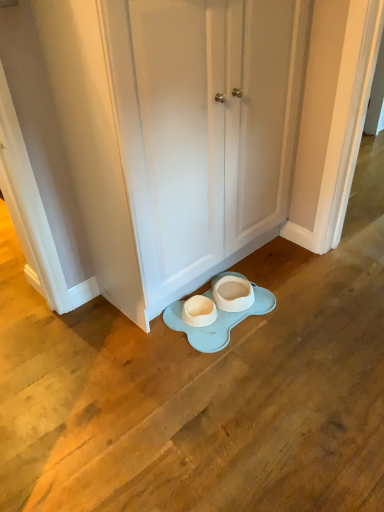
The image size is (384, 512). What do you see at coordinates (217, 322) in the screenshot?
I see `white matte porcelain at center` at bounding box center [217, 322].

Identify the location of white matte porcelain at center. The height and width of the screenshot is (512, 384). (217, 322).

What do you see at coordinates (203, 129) in the screenshot? The image size is (384, 512). I see `white matte door at center` at bounding box center [203, 129].

Locate an element on the screen. This screenshot has height=512, width=384. white matte door at center is located at coordinates (203, 129).

This screenshot has height=512, width=384. I want to click on white matte porcelain at center, so (217, 322).

Between white matte porcelain at center and white matte door at center, which one appears on the right side from the viewer's perspective?

white matte door at center.

Between white matte porcelain at center and white matte door at center, which one is positioned in front?

Positioned in front is white matte door at center.

Between point (211, 330) and point (250, 176), which one is positioned in front?

The point (211, 330) is closer to the camera.

From the image's perspective, which object appears higher, white matte porcelain at center or white matte door at center?

white matte door at center appears higher in the image.

From a real-world perspective, is white matte porcelain at center located beneath white matte door at center?

Yes, from a real-world perspective, white matte porcelain at center is beneath white matte door at center.

From the picture: Does white matte porcelain at center have a greater width compared to white matte door at center?

Yes, white matte porcelain at center is wider than white matte door at center.

Who is shorter, white matte porcelain at center or white matte door at center?

white matte porcelain at center is shorter.

Considering the relative sizes of white matte porcelain at center and white matte door at center in the image provided, is white matte porcelain at center smaller than white matte door at center?

Yes.

Is white matte porcelain at center inside the boundaries of white matte door at center, or outside?

white matte porcelain at center is located beyond the bounds of white matte door at center.

From the picture: Are white matte porcelain at center and white matte door at center located far from each other?

No, white matte porcelain at center is in close proximity to white matte door at center.

Is white matte porcelain at center positioned with its back to white matte door at center?

No, white matte porcelain at center's orientation is not away from white matte door at center.

Identify the location of door lying in front of the white matte porcelain at center. (203, 129).

Does white matte door at center appear on the right side of white matte porcelain at center?

Yes, white matte door at center is to the right of white matte porcelain at center.

Does white matte door at center come behind white matte porcelain at center?

No, the depth of white matte door at center is less than that of white matte porcelain at center.

Does point (170, 31) lie behind point (211, 326)?

That is False.

From the image's perspective, which one is positioned lower, white matte door at center or white matte porcelain at center?

white matte porcelain at center, from the image's perspective.

From a real-world perspective, who is located higher, white matte door at center or white matte porcelain at center?

white matte door at center.

Between white matte door at center and white matte porcelain at center, which one has larger width?

Wider between the two is white matte porcelain at center.

Is white matte door at center taller or shorter than white matte porcelain at center?

In the image, white matte door at center appears to be taller than white matte porcelain at center.

Considering the sizes of objects white matte door at center and white matte porcelain at center in the image provided, who is smaller, white matte door at center or white matte porcelain at center?

white matte porcelain at center.

Choose the correct answer: Is white matte door at center inside white matte porcelain at center or outside it?

white matte door at center is located beyond the bounds of white matte porcelain at center.

Is there a large distance between white matte door at center and white matte porcelain at center?

They are positioned close to each other.

Is white matte door at center facing away from white matte porcelain at center?

No.

Identify the location of door that is in front of the white matte porcelain at center. (203, 129).

This screenshot has width=384, height=512. I want to click on porcelain that is under the white matte door at center (from a real-world perspective), so click(217, 322).

Image resolution: width=384 pixels, height=512 pixels. I want to click on door above the white matte porcelain at center (from a real-world perspective), so 203,129.